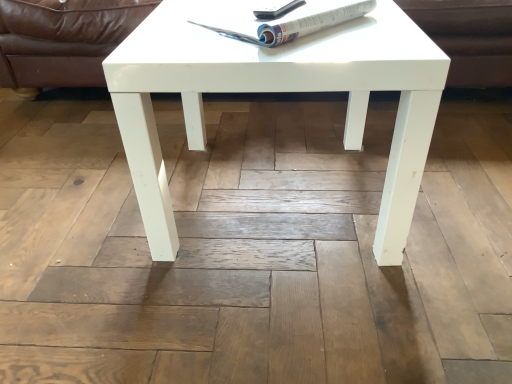
Find the location of a particular element. The image size is (512, 384). vacant space situated on the left part of white glossy coffee table at center is located at coordinates [79, 203].